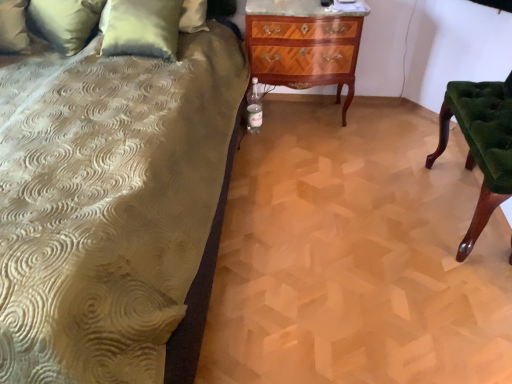
I want to click on mahogany wood chest of drawers at center, so click(x=304, y=45).

Based on the photo, measure the distance between point [96,10] and camera.

They are 2.17 meters apart.

From the picture: Measure the distance between green velvet chair at right and camera.

A distance of 1.46 meters exists between green velvet chair at right and camera.

What do you see at coordinates (480, 218) in the screenshot?
I see `green velvet chair at right` at bounding box center [480, 218].

In order to click on mahogany wood chest of drawers at center in this screenshot , I will do (304, 45).

Between point (474, 240) and point (57, 33), which one is positioned behind?

The point (57, 33) is behind.

From a real-world perspective, is green velvet chair at right located higher than green textured pillow at upper left, the 1th pillow viewed from the left?

No, from a real-world perspective, green velvet chair at right is not above green textured pillow at upper left, the 1th pillow viewed from the left.

Can you confirm if green velvet chair at right is positioned to the right of green textured pillow at upper left, which is the 2th pillow in right-to-left order?

Yes, green velvet chair at right is to the right of green textured pillow at upper left, which is the 2th pillow in right-to-left order.

The image size is (512, 384). Identify the location of furniture located on the right of green textured pillow at upper left, the 1th pillow viewed from the left. point(480,218).

How many degrees apart are the facing directions of green velvet chair at right and mahogany wood chest of drawers at center?

They differ by 90 degrees in their facing directions.

At what (x,y) coordinates should I click in order to perform the action: click on chest of drawers that appears on the left of green velvet chair at right. Please return your answer as a coordinate pair (x, y). The image size is (512, 384). Looking at the image, I should click on (304, 45).

Considering the relative positions of green velvet chair at right and mahogany wood chest of drawers at center in the image provided, is green velvet chair at right behind mahogany wood chest of drawers at center?

No, the depth of green velvet chair at right is less than that of mahogany wood chest of drawers at center.

From a real-world perspective, is green velvet chair at right located beneath mahogany wood chest of drawers at center?

Correct, in the physical world, green velvet chair at right is lower than mahogany wood chest of drawers at center.

Is green textured pillow at upper left, the 1th pillow viewed from the left, next to mahogany wood chest of drawers at center and touching it?

No, green textured pillow at upper left, the 1th pillow viewed from the left, is not next to mahogany wood chest of drawers at center.

How different are the orientations of green textured pillow at upper left, the 1th pillow viewed from the left, and mahogany wood chest of drawers at center in degrees?

34.7 degrees.

Is the depth of green textured pillow at upper left, which is the 2th pillow in right-to-left order, greater than that of mahogany wood chest of drawers at center?

That is False.

Is point (66, 39) in front of point (305, 24)?

No, it is behind (305, 24).

Which is less distant, (x=430, y=166) or (x=132, y=24)?

Point (x=430, y=166) appears to be farther away from the viewer than point (x=132, y=24).

Which of these two, green velvet chair at right or velvet green pillow at upper left, which is the 1th pillow from right to left, is smaller?

green velvet chair at right is smaller.

Is green velvet chair at right looking in the opposite direction of velvet green pillow at upper left, which is the 1th pillow from right to left?

No, green velvet chair at right's orientation is not away from velvet green pillow at upper left, which is the 1th pillow from right to left.

From the image's perspective, which one is positioned higher, green velvet chair at right or velvet green pillow at upper left, which is the 1th pillow from right to left?

velvet green pillow at upper left, which is the 1th pillow from right to left, from the image's perspective.

Considering the positions of objects velvet green pillow at upper left, which is the 1th pillow from right to left, and green textured pillow at upper left, which is the 2th pillow in right-to-left order, in the image provided, who is more to the right, velvet green pillow at upper left, which is the 1th pillow from right to left, or green textured pillow at upper left, which is the 2th pillow in right-to-left order,?

velvet green pillow at upper left, which is the 1th pillow from right to left.

Is velvet green pillow at upper left, marked as the 2th pillow in a left-to-right arrangement, beside green textured pillow at upper left, the 1th pillow viewed from the left?

No.

Which is closer, (154, 41) or (100, 5)?

The point (154, 41) is more forward.

Based on the photo, which object is wider, velvet green pillow at upper left, which is the 1th pillow from right to left, or green textured pillow at upper left, which is the 2th pillow in right-to-left order?

green textured pillow at upper left, which is the 2th pillow in right-to-left order, is wider.

Can you confirm if green textured pillow at upper left, the 1th pillow viewed from the left, is bigger than velvet green pillow at upper left, which is the 1th pillow from right to left?

Correct, green textured pillow at upper left, the 1th pillow viewed from the left, is larger in size than velvet green pillow at upper left, which is the 1th pillow from right to left.

Between green textured pillow at upper left, which is the 2th pillow in right-to-left order, and velvet green pillow at upper left, which is the 1th pillow from right to left, which one has larger width?

green textured pillow at upper left, which is the 2th pillow in right-to-left order.

From the image's perspective, is green textured pillow at upper left, which is the 2th pillow in right-to-left order, below velvet green pillow at upper left, which is the 1th pillow from right to left?

Actually, green textured pillow at upper left, which is the 2th pillow in right-to-left order, appears above velvet green pillow at upper left, which is the 1th pillow from right to left, in the image.

Does velvet green pillow at upper left, which is the 1th pillow from right to left, appear on the left side of green velvet chair at right?

Yes, velvet green pillow at upper left, which is the 1th pillow from right to left, is to the left of green velvet chair at right.

This screenshot has height=384, width=512. Identify the location of furniture below the velvet green pillow at upper left, marked as the 2th pillow in a left-to-right arrangement (from a real-world perspective). (480, 218).

Which object is wider, velvet green pillow at upper left, which is the 1th pillow from right to left, or green velvet chair at right?

Wider between the two is green velvet chair at right.

From the image's perspective, does velvet green pillow at upper left, which is the 1th pillow from right to left, appear higher than green velvet chair at right?

Yes.

From the green velvet chair at right, count the 2nd pillow to the left and point to it. Please provide its 2D coordinates.

[(65, 22)]

Where is `furniture in front of the mahogany wood chest of drawers at center`? This screenshot has height=384, width=512. furniture in front of the mahogany wood chest of drawers at center is located at coordinates (480, 218).

When comparing their distances from green velvet chair at right, does green textured pillow at upper left, which is the 2th pillow in right-to-left order, or mahogany wood chest of drawers at center seem further?

The object further to green velvet chair at right is green textured pillow at upper left, which is the 2th pillow in right-to-left order.

From the image, which object appears to be farther from green textured pillow at upper left, the 1th pillow viewed from the left, green velvet chair at right or velvet green pillow at upper left, which is the 1th pillow from right to left?

green velvet chair at right lies further to green textured pillow at upper left, the 1th pillow viewed from the left, than the other object.

Considering their positions, is mahogany wood chest of drawers at center positioned further to green textured pillow at upper left, which is the 2th pillow in right-to-left order, than velvet green pillow at upper left, marked as the 2th pillow in a left-to-right arrangement?

mahogany wood chest of drawers at center is further to green textured pillow at upper left, which is the 2th pillow in right-to-left order.

Which object lies further to the anchor point mahogany wood chest of drawers at center, green velvet chair at right or velvet green pillow at upper left, marked as the 2th pillow in a left-to-right arrangement?

The object further to mahogany wood chest of drawers at center is green velvet chair at right.

Consider the image. Estimate the real-world distances between objects in this image. Which object is closer to velvet green pillow at upper left, marked as the 2th pillow in a left-to-right arrangement, mahogany wood chest of drawers at center or green velvet chair at right?

Based on the image, mahogany wood chest of drawers at center appears to be nearer to velvet green pillow at upper left, marked as the 2th pillow in a left-to-right arrangement.

Looking at the image, which one is located closer to mahogany wood chest of drawers at center, velvet green pillow at upper left, which is the 1th pillow from right to left, or green textured pillow at upper left, the 1th pillow viewed from the left?

velvet green pillow at upper left, which is the 1th pillow from right to left.

Looking at the image, which one is located further to mahogany wood chest of drawers at center, velvet green pillow at upper left, which is the 1th pillow from right to left, or green velvet chair at right?

The object further to mahogany wood chest of drawers at center is green velvet chair at right.

Considering their positions, is velvet green pillow at upper left, which is the 1th pillow from right to left, positioned further to green textured pillow at upper left, which is the 2th pillow in right-to-left order, than green velvet chair at right?

green velvet chair at right.

Image resolution: width=512 pixels, height=384 pixels. In order to click on pillow between green textured pillow at upper left, which is the 2th pillow in right-to-left order, and mahogany wood chest of drawers at center in this screenshot , I will do `click(141, 28)`.

You are a GUI agent. You are given a task and a screenshot of the screen. Output one action in this format:
    pyautogui.click(x=<x>, y=<y>)
    Task: Click on the pillow situated between green textured pillow at upper left, the 1th pillow viewed from the left, and green velvet chair at right from left to right
    The height and width of the screenshot is (384, 512).
    Given the screenshot: What is the action you would take?
    pyautogui.click(x=141, y=28)

Locate an element on the screen. the chest of drawers located between green textured pillow at upper left, which is the 2th pillow in right-to-left order, and green velvet chair at right in the left-right direction is located at coordinates (304, 45).

Find the location of a particular element. This screenshot has height=384, width=512. the chest of drawers situated between velvet green pillow at upper left, which is the 1th pillow from right to left, and green velvet chair at right from left to right is located at coordinates (304, 45).